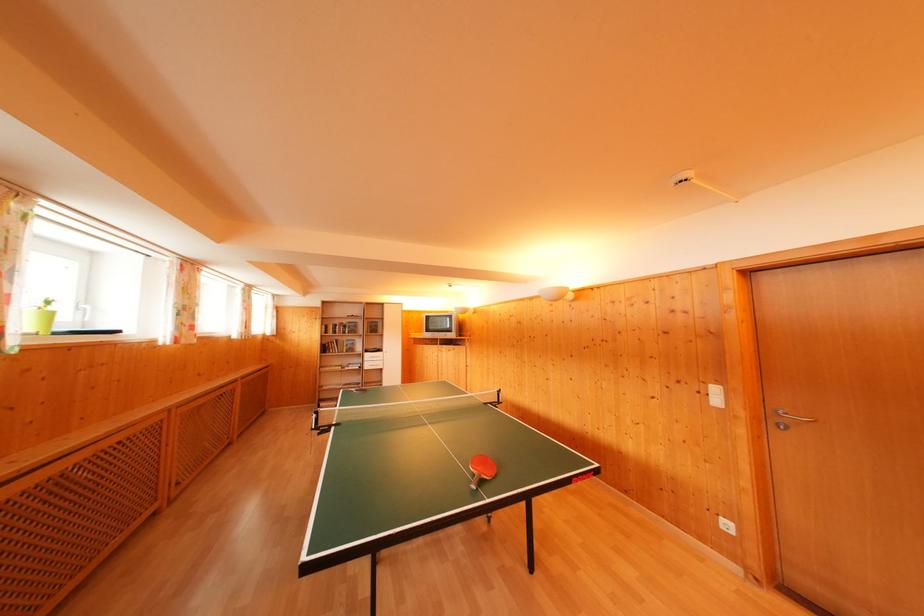
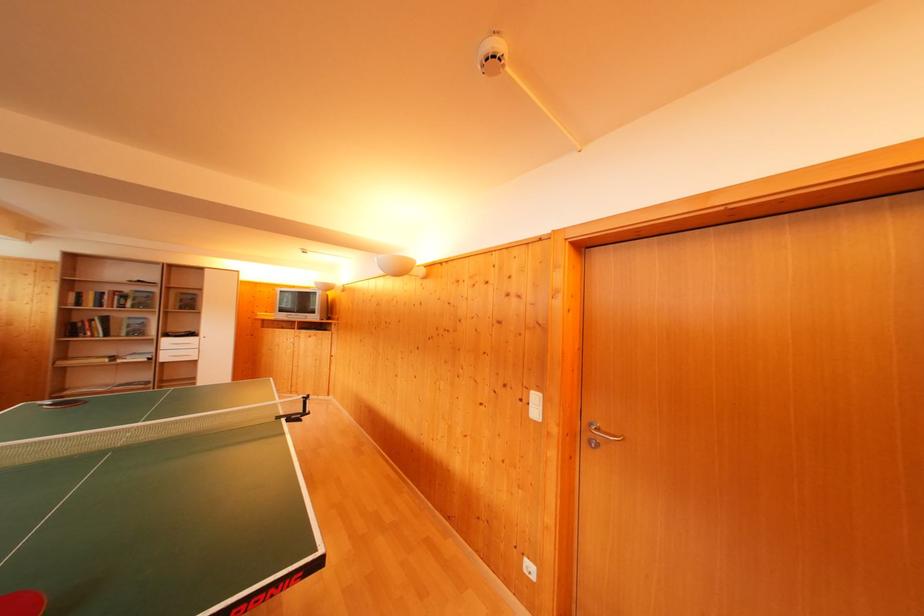
Where in the second image is the point corresponding to point (349, 326) from the first image?

(131, 294)